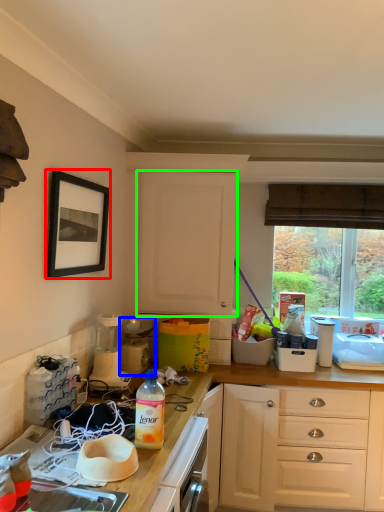
Question: Which object is positioned closest to picture frame (highlighted by a red box)? Select from appliance (highlighted by a blue box) and cabinetry (highlighted by a green box).

Choices:
 (A) appliance
 (B) cabinetry

Answer: (B)